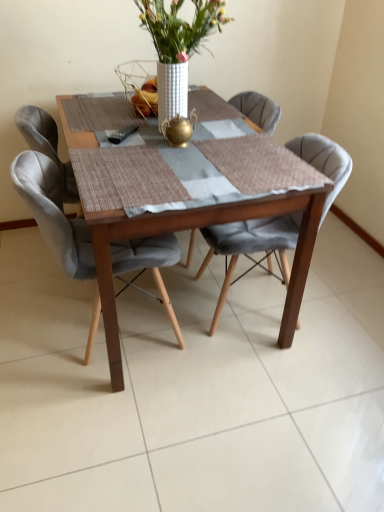
Question: Is wooden table at center not close to white textured vase at center?

Choices:
 (A) yes
 (B) no

Answer: (B)

Question: Does wooden table at center lie behind white textured vase at center?

Choices:
 (A) no
 (B) yes

Answer: (A)

Question: From the image's perspective, does wooden table at center appear lower than white textured vase at center?

Choices:
 (A) no
 (B) yes

Answer: (B)

Question: Is wooden table at center to the right of white textured vase at center from the viewer's perspective?

Choices:
 (A) no
 (B) yes

Answer: (A)

Question: From the image's perspective, would you say wooden table at center is positioned over white textured vase at center?

Choices:
 (A) no
 (B) yes

Answer: (A)

Question: Considering the positions of velvet grey chair at center, the 1th chair viewed from the right, and white textured vase at center in the image, is velvet grey chair at center, the 1th chair viewed from the right, wider or thinner than white textured vase at center?

Choices:
 (A) wide
 (B) thin

Answer: (A)

Question: In the image, is velvet grey chair at center, the 1th chair viewed from the right, positioned in front of or behind white textured vase at center?

Choices:
 (A) front
 (B) behind

Answer: (B)

Question: Based on their positions, is velvet grey chair at center, the 1th chair viewed from the right, located to the left or right of white textured vase at center?

Choices:
 (A) right
 (B) left

Answer: (A)

Question: Is velvet grey chair at center, the 1th chair viewed from the right, spatially inside white textured vase at center, or outside of it?

Choices:
 (A) outside
 (B) inside

Answer: (A)

Question: Considering the positions of velvet grey chair at center, the second chair in the right-to-left sequence, and white textured vase at center in the image, is velvet grey chair at center, the second chair in the right-to-left sequence, taller or shorter than white textured vase at center?

Choices:
 (A) short
 (B) tall

Answer: (B)

Question: From the image's perspective, is velvet grey chair at center, the second chair in the right-to-left sequence, located above or below white textured vase at center?

Choices:
 (A) below
 (B) above

Answer: (A)

Question: Would you say velvet grey chair at center, the second chair in the right-to-left sequence, is inside or outside white textured vase at center?

Choices:
 (A) outside
 (B) inside

Answer: (A)

Question: Considering the positions of velvet grey chair at center, the second chair in the right-to-left sequence, and white textured vase at center in the image, is velvet grey chair at center, the second chair in the right-to-left sequence, wider or thinner than white textured vase at center?

Choices:
 (A) wide
 (B) thin

Answer: (A)

Question: Is wooden table at center to the left or to the right of velvet grey chair at center, the second chair in the right-to-left sequence, in the image?

Choices:
 (A) left
 (B) right

Answer: (B)

Question: Choose the correct answer: Is wooden table at center inside velvet grey chair at center, the 1th chair viewed from the left, or outside it?

Choices:
 (A) inside
 (B) outside

Answer: (B)